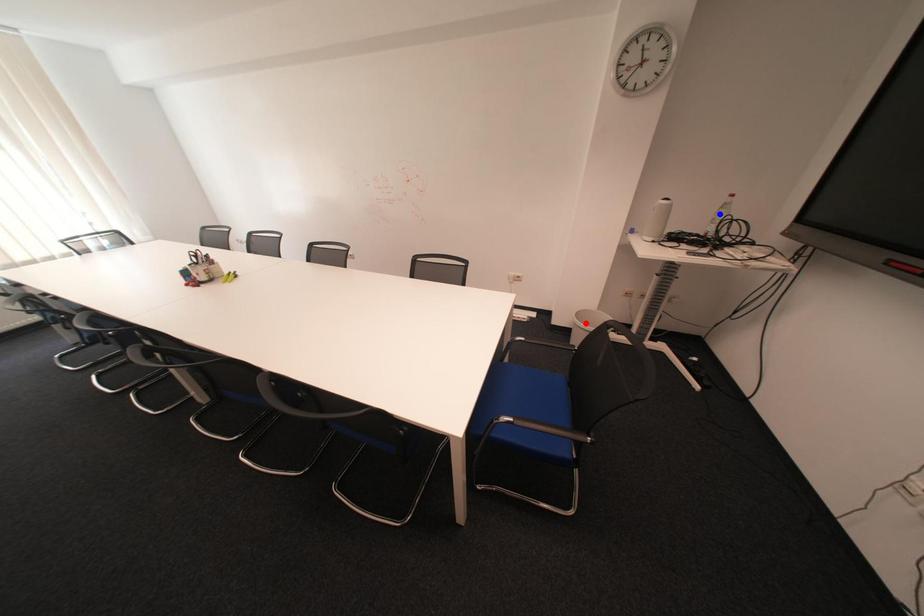
Question: Which of the two points in the image is closer to the camera?

Choices:
 (A) Blue point is closer.
 (B) Red point is closer.

Answer: (A)